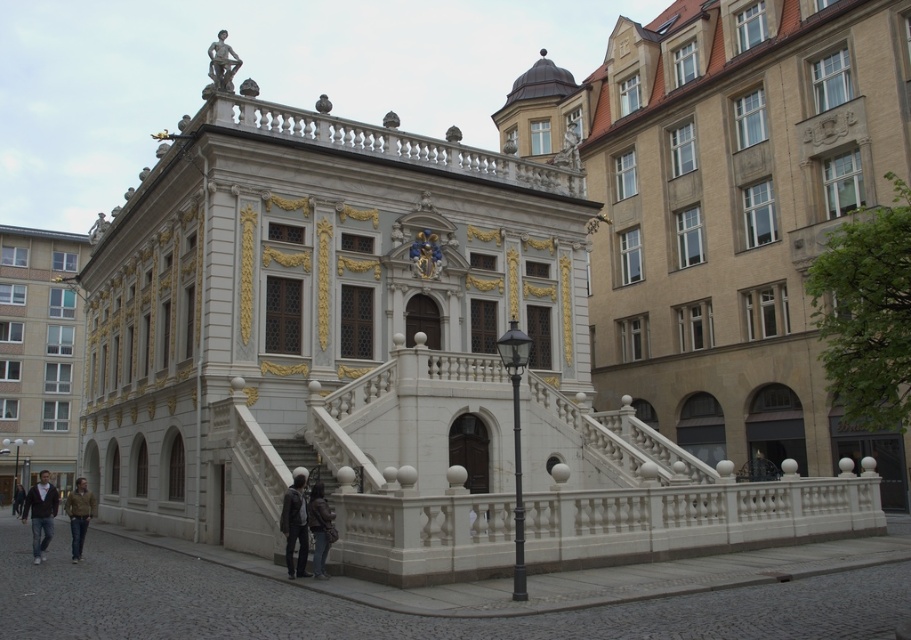
Question: Which point is farther from the camera taking this photo?

Choices:
 (A) (19, 509)
 (B) (23, 456)

Answer: (B)

Question: Does dark gray jacket at lower center lie in front of white marble stairs at center?

Choices:
 (A) no
 (B) yes

Answer: (B)

Question: Among these objects, which one is nearest to the camera?

Choices:
 (A) dark gray jacket at lower center
 (B) dark brown leather jacket at lower center
 (C) dark brown sweater at lower left

Answer: (B)

Question: Is beige stone building at center to the left of dark brown leather jacket at lower center from the viewer's perspective?

Choices:
 (A) no
 (B) yes

Answer: (A)

Question: Is brown leather jacket at lower left positioned behind dark brown leather jacket at lower left?

Choices:
 (A) yes
 (B) no

Answer: (B)

Question: Among these objects, which one is nearest to the camera?

Choices:
 (A) dark gray jacket at lower center
 (B) dark brown leather jacket at lower center
 (C) white stone palace at lower left
 (D) dark brown sweater at lower left

Answer: (B)